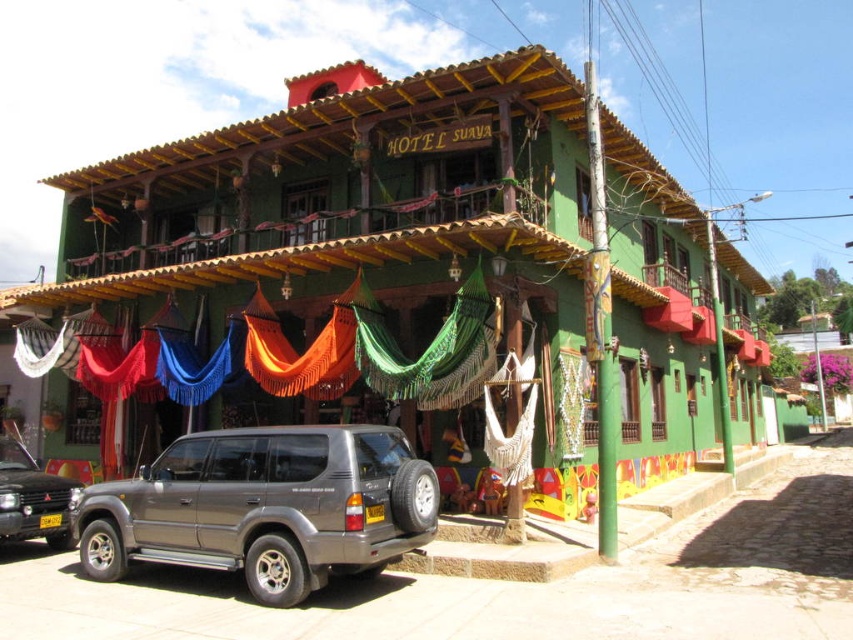
You are standing in front of the HOTEL SUAYA and want to take a photo of both the green woven hammocks at center and the metallic gray suv at lower left. Which object should you focus on first to ensure both are in the frame?

You should focus on the green woven hammocks at center first since it is closer to you than the metallic gray suv at lower left, ensuring both are in the frame by adjusting the camera angle accordingly.

Consider the image. You are standing at the entrance of the HOTEL SUAYA and want to find the green woven hammocks at center. According to the coordinates provided, where should you look relative to the hotel?

The green woven hammocks at center are located at coordinates point (410, 278), which is near the center of the hotel structure.

You are standing at the point labeled point [167,532] in front of the HOTEL SUAYA. You want to take a photo of the hotel from a distance of exactly 10 meters. Should you move closer or farther away from the hotel?

The point labeled point [167,532] is currently 9.34 meters away from the camera. To reach a distance of exactly 10 meters, you should move slightly farther away from the hotel.